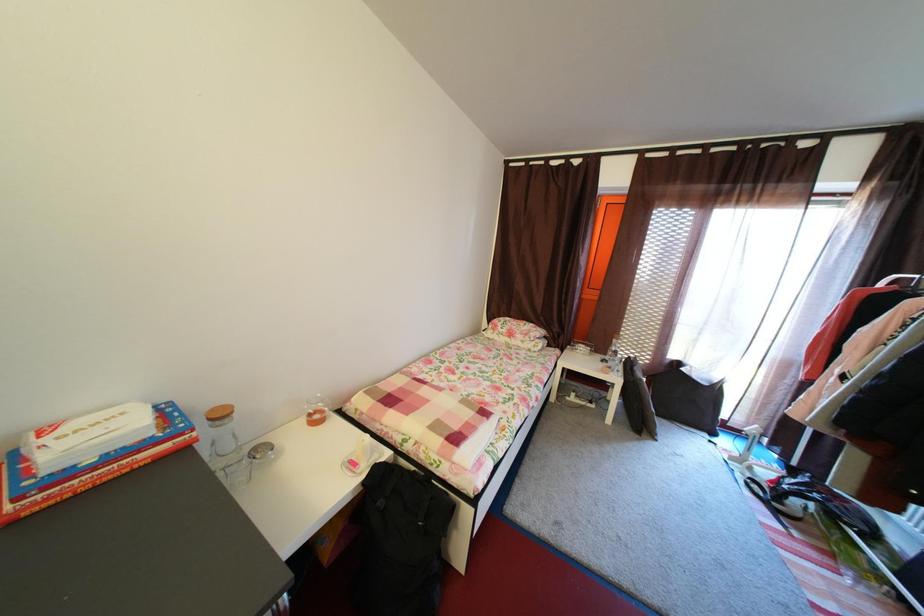
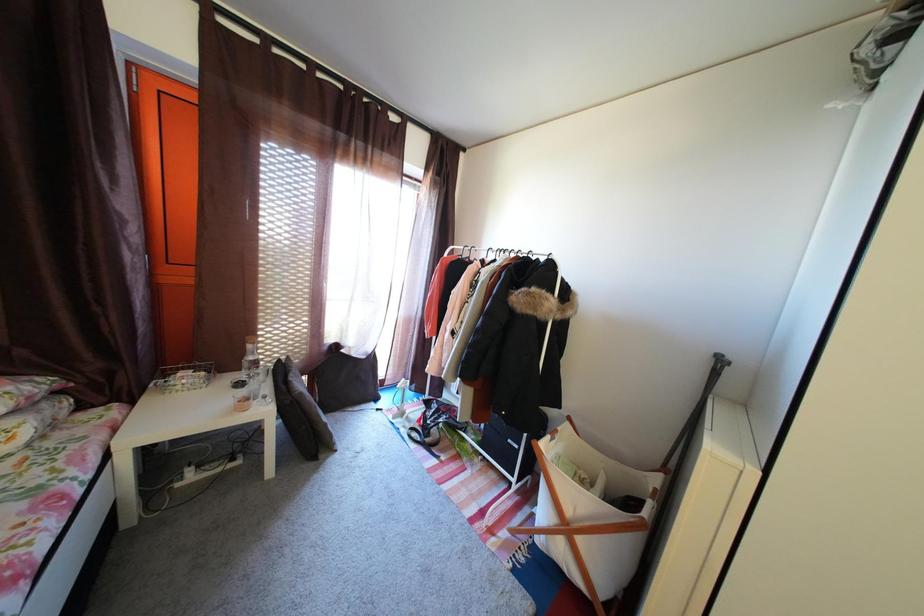
Question: The camera is either moving clockwise (left) or counter-clockwise (right) around the object. The first image is from the beginning of the video and the second image is from the end. Is the camera moving left or right when shooting the video?

Choices:
 (A) Left
 (B) Right

Answer: (A)